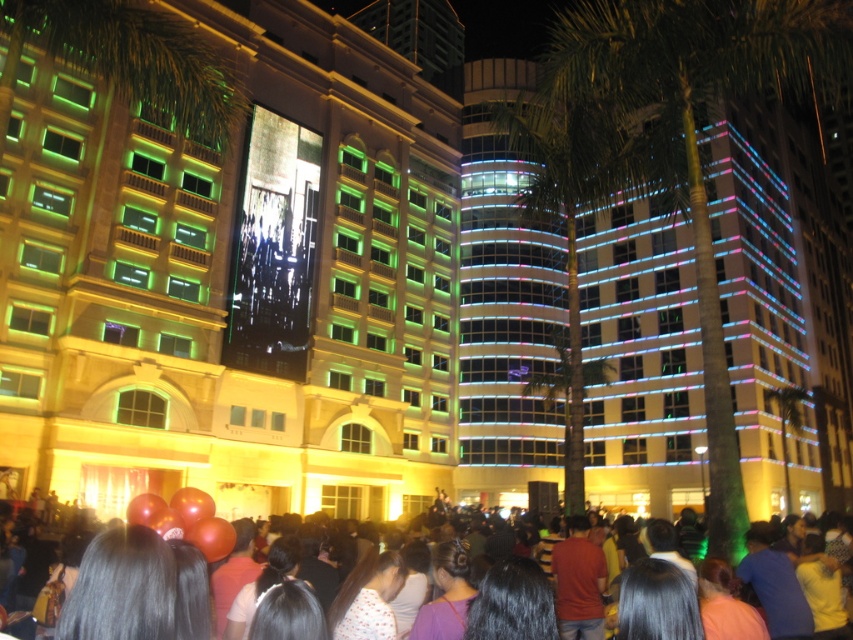
Who is more distant from viewer, [734,465] or [195,528]?

Point [734,465]

Can you confirm if green leafy palm tree at right is positioned to the right of matte red balloons at lower center?

Correct, you'll find green leafy palm tree at right to the right of matte red balloons at lower center.

Measure the distance between point (x=724, y=58) and camera.

The distance of point (x=724, y=58) from camera is 42.08 meters.

Image resolution: width=853 pixels, height=640 pixels. Identify the location of green leafy palm tree at right. (686, 141).

Is matte gold building at center taller than matte red balloons at lower center?

Yes.

Does point (90, 349) come farther from viewer compared to point (215, 534)?

That is True.

Locate an element on the screen. The image size is (853, 640). matte gold building at center is located at coordinates (233, 280).

Can you confirm if green leafy palm tree at right is positioned above green leafy palm tree at center?

Indeed, green leafy palm tree at right is positioned over green leafy palm tree at center.

Which is more to the right, green leafy palm tree at right or green leafy palm tree at center?

green leafy palm tree at center

Who is more distant from viewer, (793, 52) or (785, 468)?

The point (785, 468) is behind.

The width and height of the screenshot is (853, 640). Find the location of `green leafy palm tree at right`. green leafy palm tree at right is located at coordinates (686, 141).